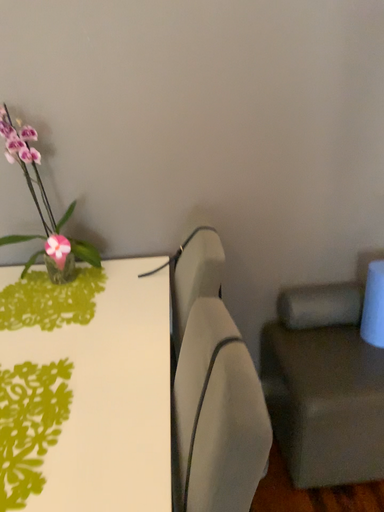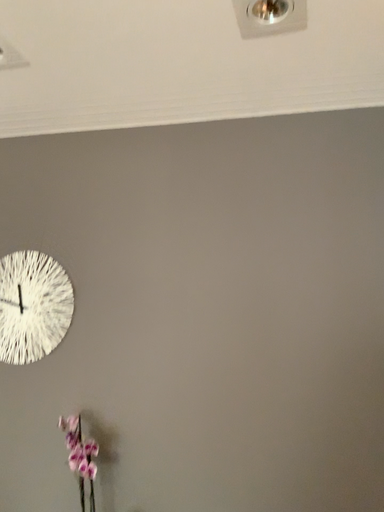
Question: How did the camera likely rotate when shooting the video?

Choices:
 (A) rotated right
 (B) rotated left

Answer: (B)